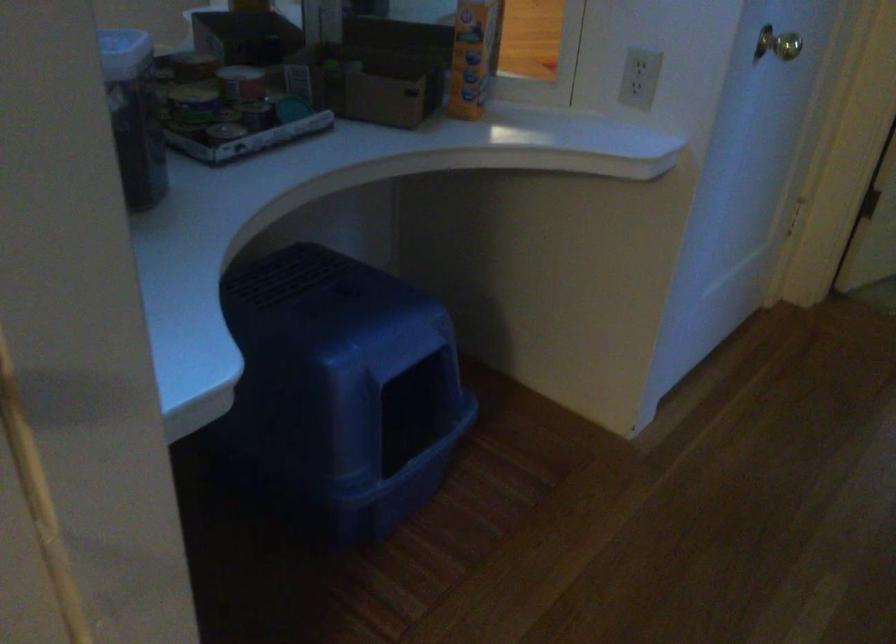
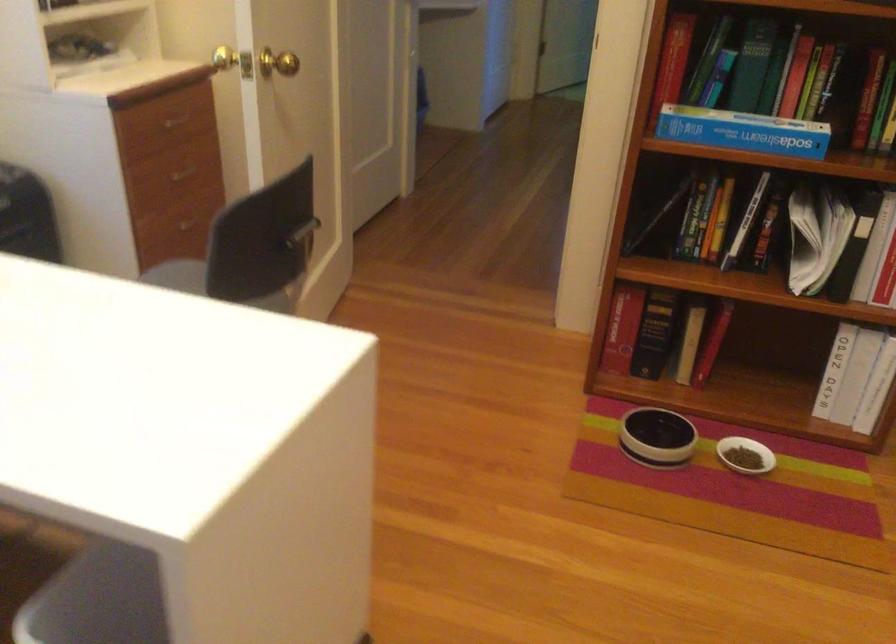
Question: I am providing you with two images of the same scene from different viewpoints. Which of the following objects are not visible in image2?

Choices:
 (A) blue litter box cover
 (B) white flip chart
 (C) black book
 (D) black and white bowl

Answer: (A)